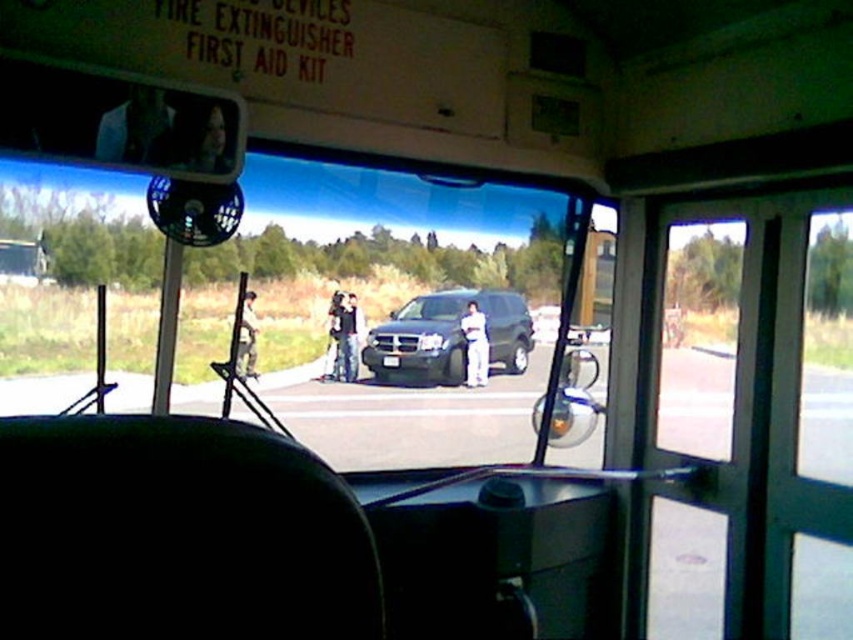
Question: Is metallic dark green suv at center to the left of camouflage fabric jacket at center from the viewer's perspective?

Choices:
 (A) no
 (B) yes

Answer: (A)

Question: Does denim pants at center have a smaller size compared to dark gray pants at center?

Choices:
 (A) yes
 (B) no

Answer: (A)

Question: Does metallic dark green suv at center come behind denim pants at center?

Choices:
 (A) no
 (B) yes

Answer: (A)

Question: Which of the following is the closest to the observer?

Choices:
 (A) (334, 305)
 (B) (480, 353)
 (C) (379, 380)

Answer: (A)

Question: Which of these objects is positioned closest to the dark gray pants at center?

Choices:
 (A) denim pants at center
 (B) white cotton pants at center
 (C) camouflage fabric jacket at center

Answer: (A)

Question: Which is farther from the metallic dark green suv at center?

Choices:
 (A) denim pants at center
 (B) white cotton pants at center
 (C) dark gray pants at center

Answer: (C)